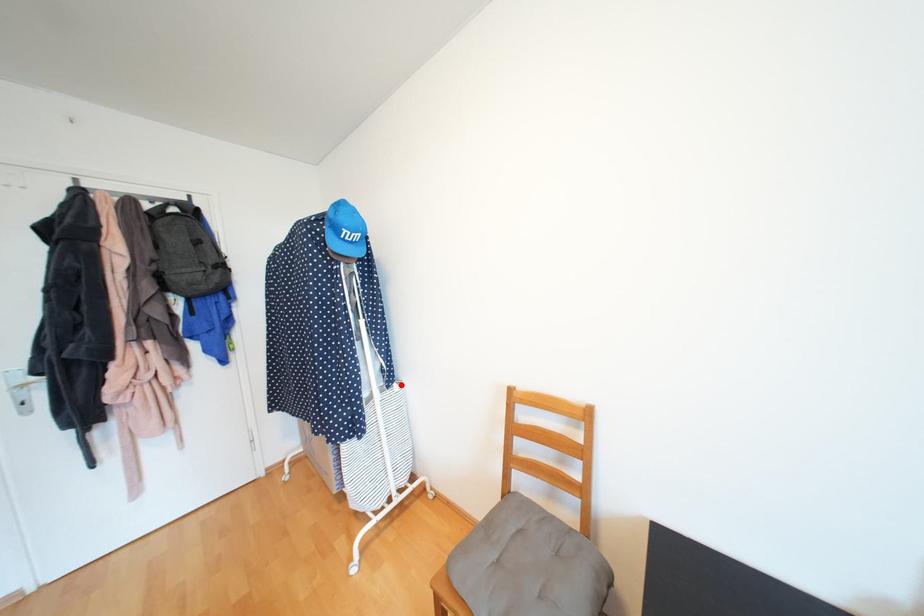
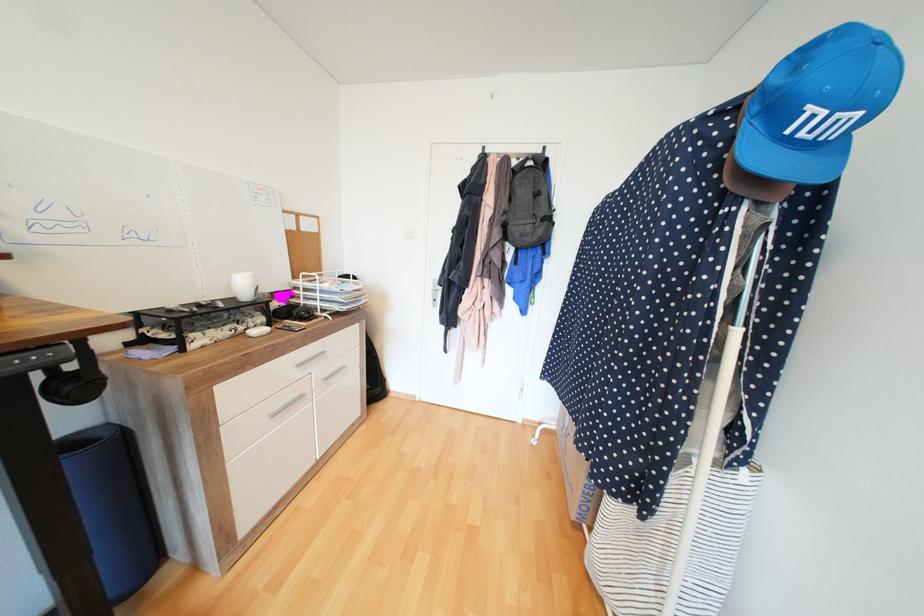
Question: A red point is marked in image1. In image2, is the corresponding 3D point closer to the camera or farther? Reply with the corresponding letter.

Choices:
 (A) The corresponding 3D point is closer.
 (B) The corresponding 3D point is farther.

Answer: (A)